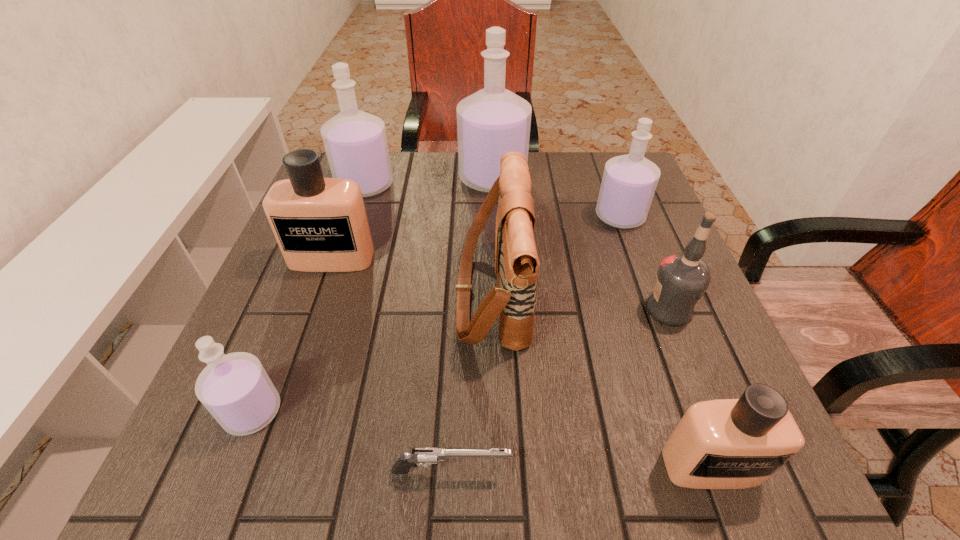
Identify the location of object positioned at the near left corner. This screenshot has width=960, height=540. (235, 388).

Where is `object situated at the far right corner`? The height and width of the screenshot is (540, 960). object situated at the far right corner is located at coordinates (629, 182).

Locate an element on the screen. The width and height of the screenshot is (960, 540). object at the near right corner is located at coordinates (739, 443).

I want to click on vacant space at the far edge of the desktop, so click(559, 188).

In the image, there is a desktop. Where is `vacant space at the near edge`? The image size is (960, 540). vacant space at the near edge is located at coordinates (401, 431).

The height and width of the screenshot is (540, 960). I want to click on vacant space at the left edge of the desktop, so click(x=272, y=289).

In the image, there is a desktop. What are the coordinates of `blank space at the right edge` in the screenshot? It's located at (612, 232).

Where is `vacant area at the near left corner of the desktop`? The image size is (960, 540). vacant area at the near left corner of the desktop is located at coordinates (273, 488).

At what (x,y) coordinates should I click in order to perform the action: click on free point at the far right corner. Please return your answer as a coordinate pair (x, y). The width and height of the screenshot is (960, 540). Looking at the image, I should click on (581, 168).

Locate an element on the screen. free space between the rightmost purple perfume and the shoulder bag is located at coordinates (556, 254).